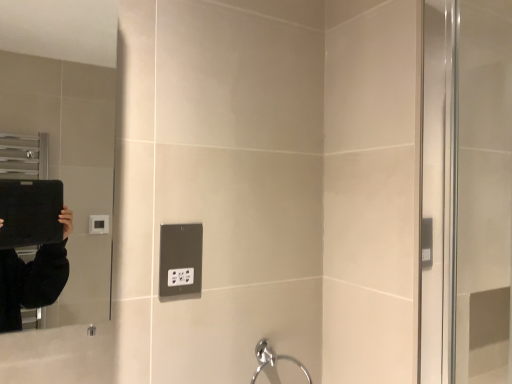
Question: From a real-world perspective, is chrome metallic faucet at lower center located higher than black plastic outlet at center?

Choices:
 (A) yes
 (B) no

Answer: (B)

Question: Does chrome metallic faucet at lower center have a greater height compared to black plastic outlet at center?

Choices:
 (A) yes
 (B) no

Answer: (A)

Question: Is chrome metallic faucet at lower center placed right next to black plastic outlet at center?

Choices:
 (A) yes
 (B) no

Answer: (B)

Question: Is chrome metallic faucet at lower center wider than black plastic outlet at center?

Choices:
 (A) yes
 (B) no

Answer: (A)

Question: Is chrome metallic faucet at lower center facing away from black plastic outlet at center?

Choices:
 (A) no
 (B) yes

Answer: (A)

Question: From a real-world perspective, is chrome metallic faucet at lower center physically below black plastic outlet at center?

Choices:
 (A) no
 (B) yes

Answer: (B)

Question: Are chrome metallic faucet at lower center and matte black mirror at left located far from each other?

Choices:
 (A) no
 (B) yes

Answer: (B)

Question: Could you tell me if chrome metallic faucet at lower center is facing matte black mirror at left?

Choices:
 (A) no
 (B) yes

Answer: (A)

Question: Can you confirm if chrome metallic faucet at lower center is wider than matte black mirror at left?

Choices:
 (A) no
 (B) yes

Answer: (A)

Question: Does chrome metallic faucet at lower center have a smaller size compared to matte black mirror at left?

Choices:
 (A) yes
 (B) no

Answer: (A)

Question: Is chrome metallic faucet at lower center in front of matte black mirror at left?

Choices:
 (A) yes
 (B) no

Answer: (B)

Question: Is chrome metallic faucet at lower center bigger than matte black mirror at left?

Choices:
 (A) yes
 (B) no

Answer: (B)

Question: Considering the relative sizes of matte black mirror at left and black plastic outlet at center in the image provided, is matte black mirror at left bigger than black plastic outlet at center?

Choices:
 (A) yes
 (B) no

Answer: (A)